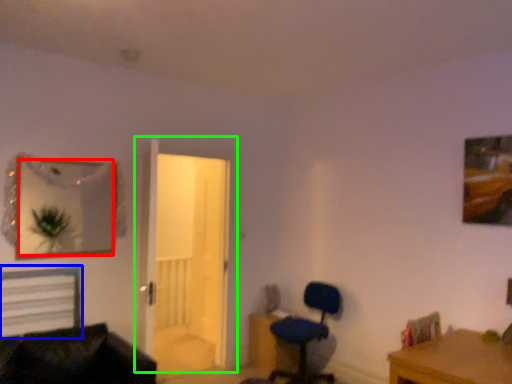
Question: Which object is positioned farthest from mirror (highlighted by a red box)? Select from bed (highlighted by a blue box) and door (highlighted by a green box).

Choices:
 (A) bed
 (B) door

Answer: (B)